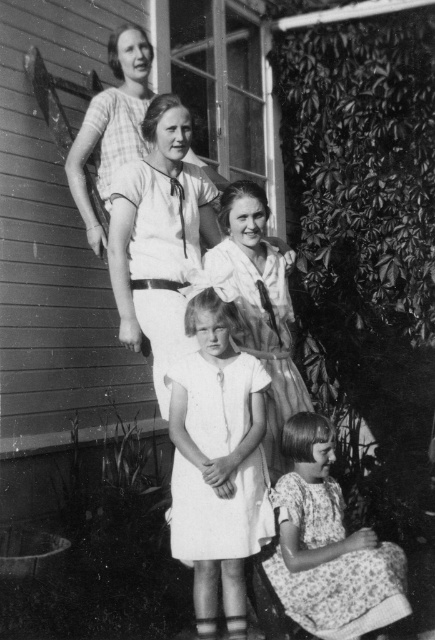
Question: Does white cotton dress at center appear on the right side of light beige cotton dress at upper center?

Choices:
 (A) yes
 (B) no

Answer: (A)

Question: Which object is positioned farthest from the light beige cotton dress at upper center?

Choices:
 (A) floral dress at lower right
 (B) white cotton dress at center
 (C) draped fabric dress at center

Answer: (A)

Question: Does matte white blouse at center have a greater width compared to draped fabric dress at center?

Choices:
 (A) no
 (B) yes

Answer: (A)

Question: Which point is farther to the camera?

Choices:
 (A) matte white blouse at center
 (B) light beige cotton dress at upper center
 (C) white cotton dress at center

Answer: (B)

Question: Is floral dress at lower right closer to the viewer compared to draped fabric dress at center?

Choices:
 (A) yes
 (B) no

Answer: (A)

Question: Which point appears closest to the camera in this image?

Choices:
 (A) (325, 589)
 (B) (151, 340)
 (C) (254, 264)

Answer: (A)